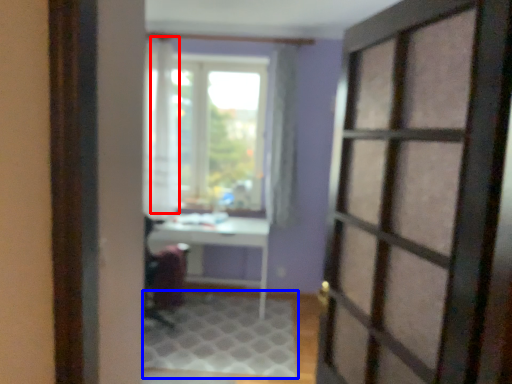
Question: Which object appears closest to the camera in this image, curtain (highlighted by a red box) or doormat (highlighted by a blue box)?

Choices:
 (A) curtain
 (B) doormat

Answer: (B)